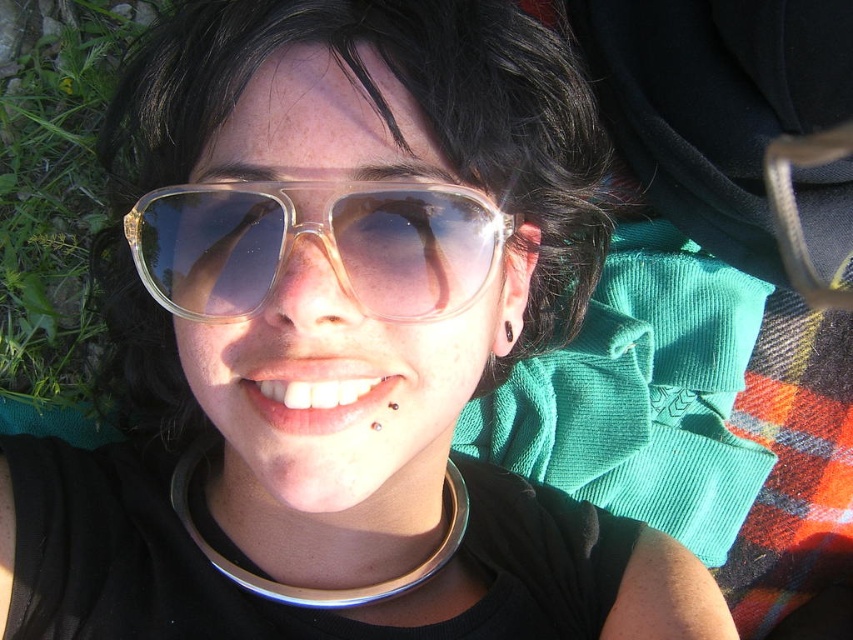
Can you confirm if transparent plastic goggles at center is positioned above green grass at lower left?

Incorrect, transparent plastic goggles at center is not positioned above green grass at lower left.

Does point (363, 234) come behind point (35, 88)?

No.

Locate an element on the screen. transparent plastic goggles at center is located at coordinates (318, 243).